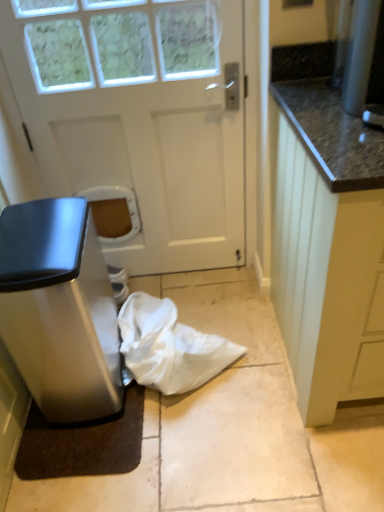
I want to click on free space between white fabric bag at lower center and satin silver trash can at left, so click(178, 393).